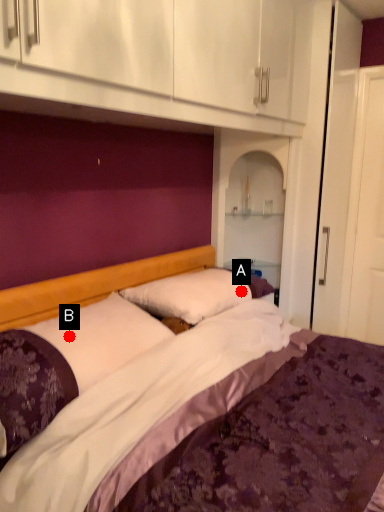
Question: Two points are circled on the image, labeled by A and B beside each circle. Which of the following is the farthest from the observer?

Choices:
 (A) A is further
 (B) B is further

Answer: (A)